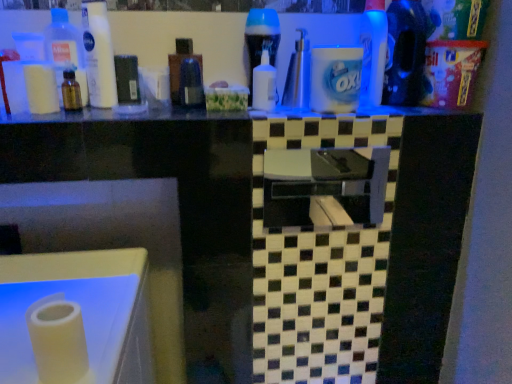
Where is `vacant area that is in front of blue glossy bottle at center, positioned as the third bottle in right-to-left order`? vacant area that is in front of blue glossy bottle at center, positioned as the third bottle in right-to-left order is located at coordinates (249, 111).